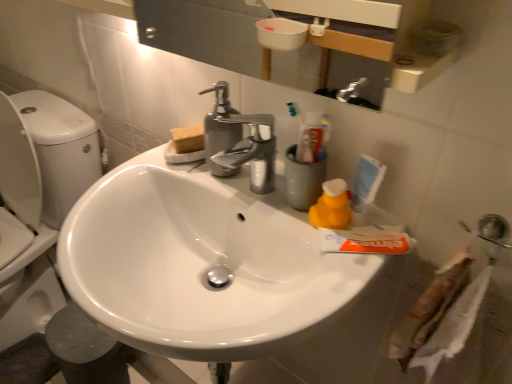
This screenshot has width=512, height=384. I want to click on empty space that is ontop of white glossy sink at center (from a real-world perspective), so click(216, 181).